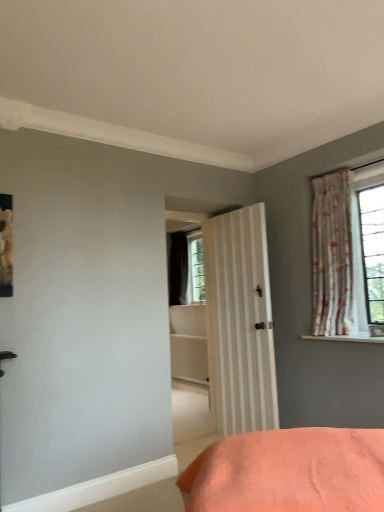
In order to face floral fabric curtain at right, should I rotate leftwards or rightwards?

Rotate right and turn 18.315 degrees.

The width and height of the screenshot is (384, 512). Describe the element at coordinates (332, 255) in the screenshot. I see `floral fabric curtain at right` at that location.

At what (x,y) coordinates should I click in order to perform the action: click on floral fabric curtain at right. Please return your answer as a coordinate pair (x, y). Looking at the image, I should click on (332, 255).

Measure the distance between point (346, 294) and camera.

Point (346, 294) and camera are 10.31 feet apart.

At what (x,y) coordinates should I click in order to perform the action: click on white textured shelf at upper right. Please return your answer as a coordinate pair (x, y). This screenshot has width=384, height=512. Looking at the image, I should click on (348, 338).

What do you see at coordinates (348, 338) in the screenshot? Image resolution: width=384 pixels, height=512 pixels. I see `white textured shelf at upper right` at bounding box center [348, 338].

What are the coordinates of `floral fabric curtain at right` in the screenshot? It's located at (332, 255).

Would you say floral fabric curtain at right is to the left or to the right of white textured shelf at upper right in the picture?

Clearly, floral fabric curtain at right is on the left of white textured shelf at upper right in the image.

Which object is further away from the camera, floral fabric curtain at right or white textured shelf at upper right?

floral fabric curtain at right.

Does point (348, 312) lie in front of point (321, 338)?

That is True.

From the image's perspective, is floral fabric curtain at right over white textured shelf at upper right?

Correct, floral fabric curtain at right appears higher than white textured shelf at upper right in the image.

From a real-world perspective, which is physically below, floral fabric curtain at right or white textured shelf at upper right?

white textured shelf at upper right is physically lower.

Which object is thinner, floral fabric curtain at right or white textured shelf at upper right?

Thinner between the two is floral fabric curtain at right.

In terms of height, does floral fabric curtain at right look taller or shorter compared to white textured shelf at upper right?

floral fabric curtain at right is taller than white textured shelf at upper right.

Based on the photo, based on their sizes in the image, would you say floral fabric curtain at right is bigger or smaller than white textured shelf at upper right?

In the image, floral fabric curtain at right appears to be larger than white textured shelf at upper right.

Is white textured shelf at upper right located within floral fabric curtain at right?

No, floral fabric curtain at right does not contain white textured shelf at upper right.

Would you say floral fabric curtain at right is a long distance from white textured shelf at upper right?

They are positioned close to each other.

Is floral fabric curtain at right facing away from white textured shelf at upper right?

That's not correct — floral fabric curtain at right is not looking away from white textured shelf at upper right.

What's the angular difference between floral fabric curtain at right and white textured shelf at upper right's facing directions?

There is a 0.000514-degree angle between the facing directions of floral fabric curtain at right and white textured shelf at upper right.

At what (x,y) coordinates should I click in order to perform the action: click on window sill lying on the right of floral fabric curtain at right. Please return your answer as a coordinate pair (x, y). The width and height of the screenshot is (384, 512). Looking at the image, I should click on (348, 338).

Is white textured shelf at upper right to the right of floral fabric curtain at right from the viewer's perspective?

Indeed, white textured shelf at upper right is positioned on the right side of floral fabric curtain at right.

In the image, is white textured shelf at upper right positioned in front of or behind floral fabric curtain at right?

white textured shelf at upper right is positioned closer to the viewer than floral fabric curtain at right.

Does point (321, 340) appear closer or farther from the camera than point (338, 220)?

Point (321, 340).

From the image's perspective, is white textured shelf at upper right positioned above or below floral fabric curtain at right?

white textured shelf at upper right is below floral fabric curtain at right.

From a real-world perspective, is white textured shelf at upper right positioned under floral fabric curtain at right based on gravity?

Yes, from a real-world perspective, white textured shelf at upper right is beneath floral fabric curtain at right.

Which of these two, white textured shelf at upper right or floral fabric curtain at right, is wider?

white textured shelf at upper right is wider.

Does white textured shelf at upper right have a lesser height compared to floral fabric curtain at right?

Yes, white textured shelf at upper right is shorter than floral fabric curtain at right.

Considering the relative sizes of white textured shelf at upper right and floral fabric curtain at right in the image provided, is white textured shelf at upper right bigger than floral fabric curtain at right?

Incorrect, white textured shelf at upper right is not larger than floral fabric curtain at right.

Consider the image. Would you say white textured shelf at upper right is outside floral fabric curtain at right?

Indeed, white textured shelf at upper right is completely outside floral fabric curtain at right.

Is white textured shelf at upper right far from floral fabric curtain at right?

No, there isn't a large distance between white textured shelf at upper right and floral fabric curtain at right.

Is white textured shelf at upper right aimed at floral fabric curtain at right?

No, white textured shelf at upper right is not aimed at floral fabric curtain at right.

Looking at this image, measure the distance from white textured shelf at upper right to floral fabric curtain at right.

They are 20.45 inches apart.

Identify the location of curtain that is above the white textured shelf at upper right (from the image's perspective). (332, 255).

Where is `curtain on the left of the white textured shelf at upper right`? curtain on the left of the white textured shelf at upper right is located at coordinates (332, 255).

Identify the location of window sill in front of the floral fabric curtain at right. (348, 338).